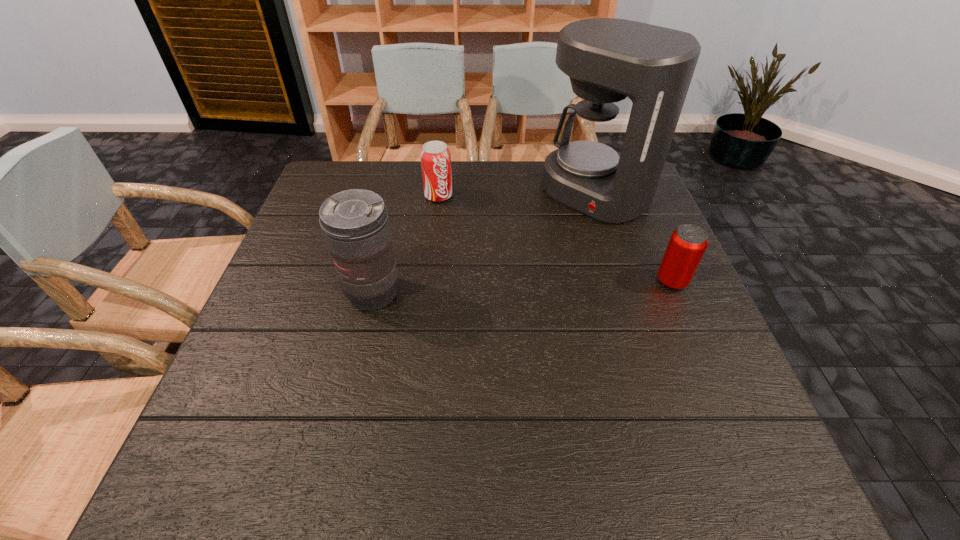
At what (x,y) coordinates should I click in order to perform the action: click on free region located 0.400m on the button side of the tallest object. Please return your answer as a coordinate pair (x, y). Looking at the image, I should click on (467, 300).

The width and height of the screenshot is (960, 540). I want to click on vacant space located 0.220m on the button side of the tallest object, so click(x=516, y=259).

The height and width of the screenshot is (540, 960). What are the coordinates of `free space located on the button side of the tallest object` in the screenshot? It's located at (467, 300).

The width and height of the screenshot is (960, 540). In order to click on soda can located at the far edge in this screenshot , I will do `click(435, 156)`.

In order to click on coffee maker situated at the far edge in this screenshot , I will do `click(607, 59)`.

The height and width of the screenshot is (540, 960). I want to click on can situated at the right edge, so click(x=687, y=245).

Find the location of a particular element. coffee maker that is at the right edge is located at coordinates (607, 59).

Find the location of `object present at the far right corner`. object present at the far right corner is located at coordinates (607, 59).

At what (x,y) coordinates should I click in order to perform the action: click on blank space at the far edge of the desktop. Please return your answer as a coordinate pair (x, y). The height and width of the screenshot is (540, 960). Looking at the image, I should click on (456, 180).

What are the coordinates of `free space at the near edge of the desktop` in the screenshot? It's located at (547, 384).